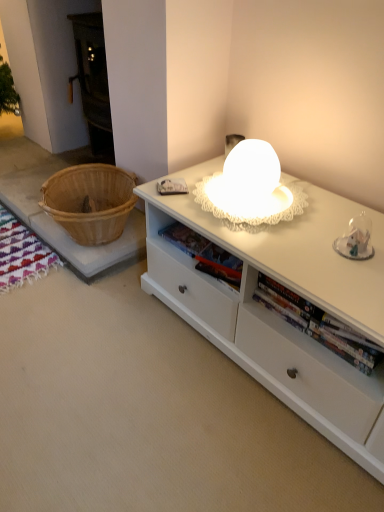
Question: Does hardcover book at center lie behind white matte cabinet at center?

Choices:
 (A) yes
 (B) no

Answer: (A)

Question: Does hardcover book at center have a smaller size compared to white matte cabinet at center?

Choices:
 (A) no
 (B) yes

Answer: (B)

Question: Is hardcover book at center bigger than white matte cabinet at center?

Choices:
 (A) yes
 (B) no

Answer: (B)

Question: Could white matte cabinet at center be considered to be inside hardcover book at center?

Choices:
 (A) no
 (B) yes

Answer: (A)

Question: Is hardcover book at center aimed at white matte cabinet at center?

Choices:
 (A) no
 (B) yes

Answer: (A)

Question: Is hardcover book at center outside of white matte cabinet at center?

Choices:
 (A) no
 (B) yes

Answer: (B)

Question: Is white matte cabinet at center to the left of hardcover book at center from the viewer's perspective?

Choices:
 (A) no
 (B) yes

Answer: (B)

Question: Is white matte cabinet at center not within hardcover book at center?

Choices:
 (A) no
 (B) yes

Answer: (B)

Question: Considering the relative sizes of white matte cabinet at center and hardcover book at center in the image provided, is white matte cabinet at center bigger than hardcover book at center?

Choices:
 (A) no
 (B) yes

Answer: (B)

Question: Can you confirm if white matte cabinet at center is positioned to the right of hardcover book at center?

Choices:
 (A) yes
 (B) no

Answer: (B)

Question: Is white matte cabinet at center far from hardcover book at center?

Choices:
 (A) yes
 (B) no

Answer: (B)

Question: Can you confirm if white matte cabinet at center is taller than hardcover book at center?

Choices:
 (A) no
 (B) yes

Answer: (B)

Question: Would you say white matte cabinet at center is to the left or to the right of hardcover book at center in the picture?

Choices:
 (A) right
 (B) left

Answer: (B)